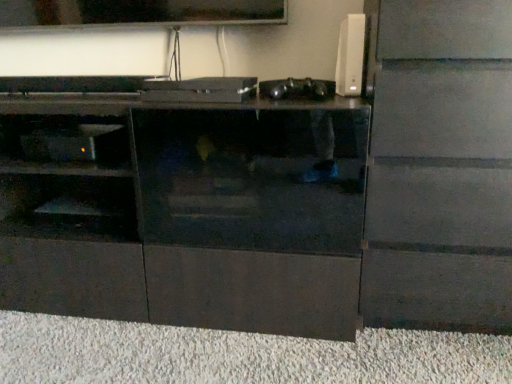
I want to click on matte black shelf at lower left, so click(x=64, y=146).

This screenshot has width=512, height=384. What do you see at coordinates (64, 146) in the screenshot? I see `matte black shelf at lower left` at bounding box center [64, 146].

Identify the location of matte black shelf at lower left. The image size is (512, 384). (64, 146).